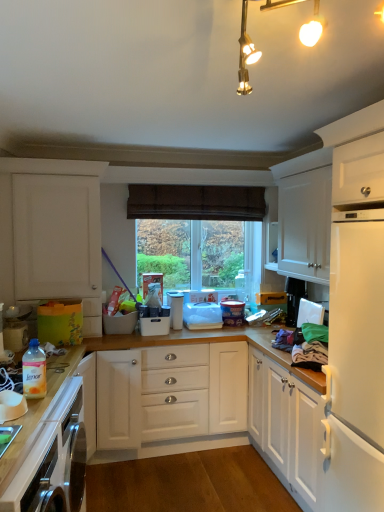
Question: Which direction should I rotate to face white plastic container at center, positioned as the 3th appliance in left-to-right order, — up or down?

Choices:
 (A) down
 (B) up

Answer: (A)

Question: From a real-world perspective, is white plastic container at center, which is counted as the 1th appliance, starting from the back, positioned under translucent plastic fabric softener at lower left, which is the 1th appliance in front-to-back order, based on gravity?

Choices:
 (A) yes
 (B) no

Answer: (A)

Question: Could translucent plastic fabric softener at lower left, placed as the fourth appliance when sorted from back to front, be considered to be inside white plastic container at center, which is counted as the 4th appliance, starting from the front?

Choices:
 (A) yes
 (B) no

Answer: (B)

Question: From the image's perspective, would you say white plastic container at center, which is counted as the 1th appliance, starting from the back, is shown under translucent plastic fabric softener at lower left, placed as the fourth appliance when sorted from back to front?

Choices:
 (A) yes
 (B) no

Answer: (B)

Question: Are white plastic container at center, which is counted as the 4th appliance, starting from the left, and translucent plastic fabric softener at lower left, placed as the fourth appliance when sorted from back to front, beside each other?

Choices:
 (A) yes
 (B) no

Answer: (B)

Question: Can you confirm if white plastic container at center, which is counted as the 4th appliance, starting from the left, is thinner than translucent plastic fabric softener at lower left, acting as the 4th appliance starting from the right?

Choices:
 (A) yes
 (B) no

Answer: (B)

Question: From the image's perspective, would you say white plastic container at center, which is counted as the 4th appliance, starting from the left, is positioned over translucent plastic fabric softener at lower left, placed as the fourth appliance when sorted from back to front?

Choices:
 (A) no
 (B) yes

Answer: (B)

Question: From a real-world perspective, does wooden countertop at lower left stand above translucent plastic fabric softener at lower left, which is the 1th appliance in front-to-back order?

Choices:
 (A) yes
 (B) no

Answer: (B)

Question: Is wooden countertop at lower left positioned in front of translucent plastic fabric softener at lower left, which is the 1th appliance in front-to-back order?

Choices:
 (A) no
 (B) yes

Answer: (B)

Question: Considering the relative positions of wooden countertop at lower left and translucent plastic fabric softener at lower left, which is the 1th appliance in front-to-back order, in the image provided, is wooden countertop at lower left to the left of translucent plastic fabric softener at lower left, which is the 1th appliance in front-to-back order, from the viewer's perspective?

Choices:
 (A) yes
 (B) no

Answer: (A)

Question: Is wooden countertop at lower left smaller than translucent plastic fabric softener at lower left, which is the 1th appliance in front-to-back order?

Choices:
 (A) yes
 (B) no

Answer: (B)

Question: From the image's perspective, is wooden countertop at lower left below translucent plastic fabric softener at lower left, acting as the 4th appliance starting from the right?

Choices:
 (A) yes
 (B) no

Answer: (A)

Question: From the image's perspective, is wooden countertop at lower left on translucent plastic fabric softener at lower left, which is the 1th appliance in front-to-back order?

Choices:
 (A) no
 (B) yes

Answer: (A)

Question: Considering the relative sizes of white matte cabinet at left, marked as the 1th cabinetry in a left-to-right arrangement, and white plastic container at center, the second appliance in the back-to-front sequence, in the image provided, is white matte cabinet at left, marked as the 1th cabinetry in a left-to-right arrangement, bigger than white plastic container at center, the second appliance in the back-to-front sequence,?

Choices:
 (A) yes
 (B) no

Answer: (A)